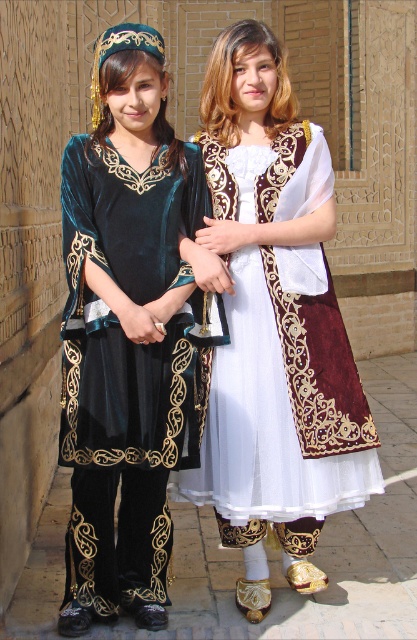
Does velvet teal dress at center have a greater height compared to white velvet dress at center?

Result: Indeed, velvet teal dress at center has a greater height compared to white velvet dress at center.

Is point (70, 285) positioned before point (238, 500)?

Yes, it is in front of point (238, 500).

What do you see at coordinates (128, 333) in the screenshot?
I see `velvet teal dress at center` at bounding box center [128, 333].

The height and width of the screenshot is (640, 417). Find the location of `velvet teal dress at center`. velvet teal dress at center is located at coordinates (128, 333).